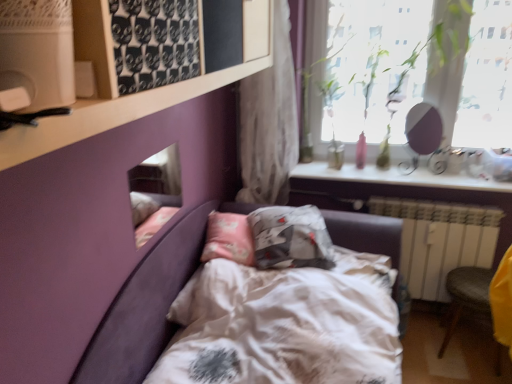
Question: Is white textured curtain at upper center taller than yellow fabric armchair at lower right?

Choices:
 (A) no
 (B) yes

Answer: (B)

Question: Would you say white textured curtain at upper center contains yellow fabric armchair at lower right?

Choices:
 (A) no
 (B) yes

Answer: (A)

Question: Is white textured curtain at upper center thinner than yellow fabric armchair at lower right?

Choices:
 (A) no
 (B) yes

Answer: (B)

Question: Does white textured curtain at upper center have a greater width compared to yellow fabric armchair at lower right?

Choices:
 (A) no
 (B) yes

Answer: (A)

Question: Considering the relative positions of white textured curtain at upper center and yellow fabric armchair at lower right in the image provided, is white textured curtain at upper center to the left of yellow fabric armchair at lower right from the viewer's perspective?

Choices:
 (A) yes
 (B) no

Answer: (A)

Question: Is point (233, 332) positioned closer to the camera than point (401, 241)?

Choices:
 (A) closer
 (B) farther

Answer: (A)

Question: From a real-world perspective, relative to white painted metal radiator at lower right, is white satin bed at center vertically above or below?

Choices:
 (A) below
 (B) above

Answer: (B)

Question: From the image's perspective, is white satin bed at center above or below white painted metal radiator at lower right?

Choices:
 (A) below
 (B) above

Answer: (A)

Question: Based on their positions, is white satin bed at center located to the left or right of white painted metal radiator at lower right?

Choices:
 (A) left
 (B) right

Answer: (A)

Question: Is point (105, 109) positioned closer to the camera than point (305, 317)?

Choices:
 (A) farther
 (B) closer

Answer: (B)

Question: Looking at the image, does white matte shelf at upper left seem bigger or smaller compared to white satin bed at center?

Choices:
 (A) small
 (B) big

Answer: (A)

Question: Based on their positions, is white matte shelf at upper left located to the left or right of white satin bed at center?

Choices:
 (A) right
 (B) left

Answer: (B)

Question: From the image's perspective, is white matte shelf at upper left located above or below white satin bed at center?

Choices:
 (A) below
 (B) above

Answer: (B)

Question: From the image's perspective, is transparent glass window at upper right above or below white glossy shelf at upper right?

Choices:
 (A) below
 (B) above

Answer: (B)

Question: In terms of width, does transparent glass window at upper right look wider or thinner when compared to white glossy shelf at upper right?

Choices:
 (A) thin
 (B) wide

Answer: (A)